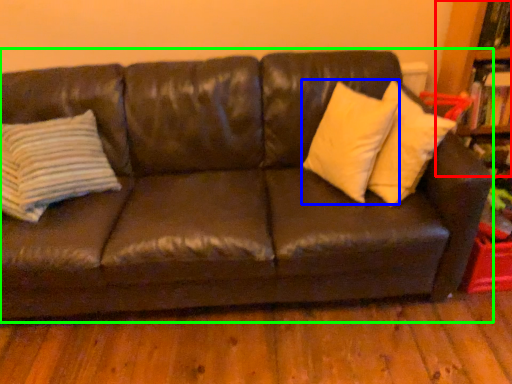
Question: Based on their relative distances, which object is nearer to bookcase (highlighted by a red box)? Choose from pillow (highlighted by a blue box) and studio couch (highlighted by a green box).

Choices:
 (A) pillow
 (B) studio couch

Answer: (A)